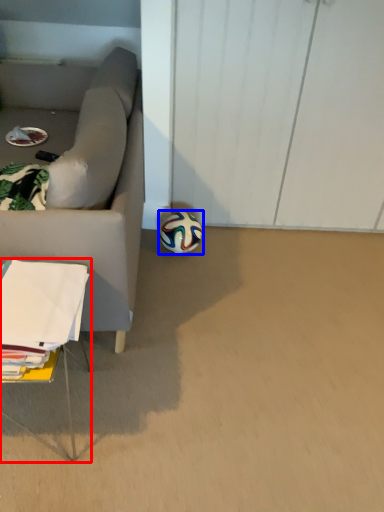
Question: Among these objects, which one is farthest to the camera, table (highlighted by a red box) or football (highlighted by a blue box)?

Choices:
 (A) table
 (B) football

Answer: (B)